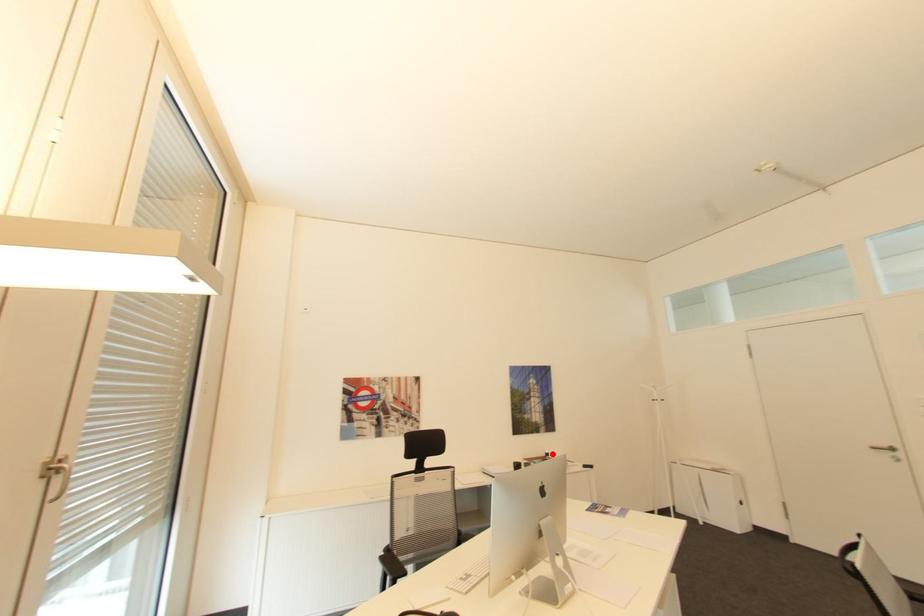
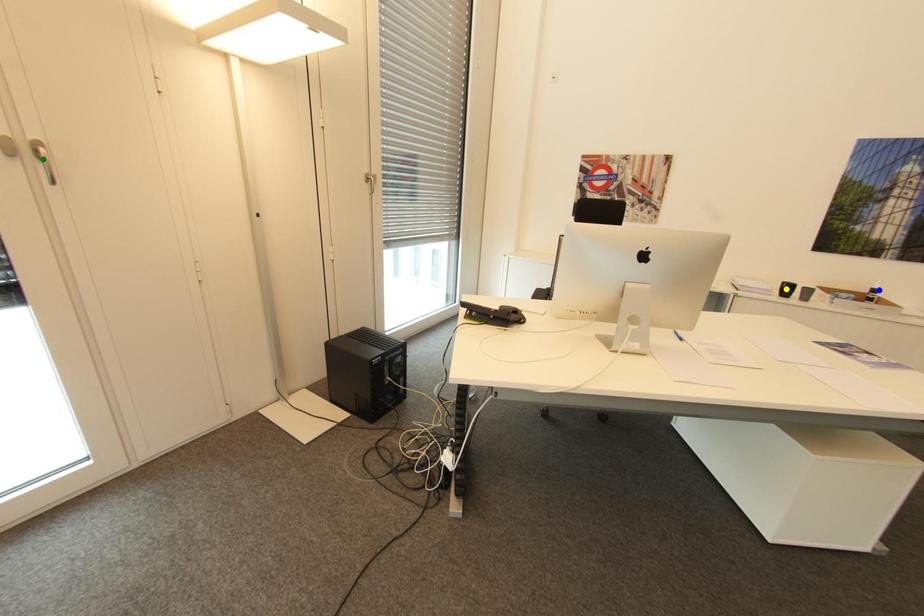
Question: I am providing you with two images of the same scene from different viewpoints. A red point is marked on the first image. You are given multiple points on the second image. In image 2, which mark is for the same physical point as the one in image 1?

Choices:
 (A) yellow point
 (B) blue point
 (C) green point

Answer: (B)